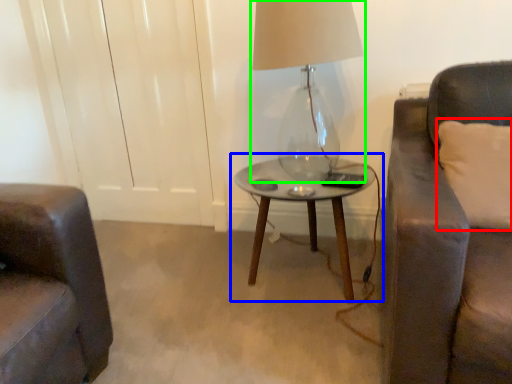
Question: Estimate the real-world distances between objects in this image. Which object is closer to pillow (highlighted by a red box), table (highlighted by a blue box) or lamp (highlighted by a green box)?

Choices:
 (A) table
 (B) lamp

Answer: (A)